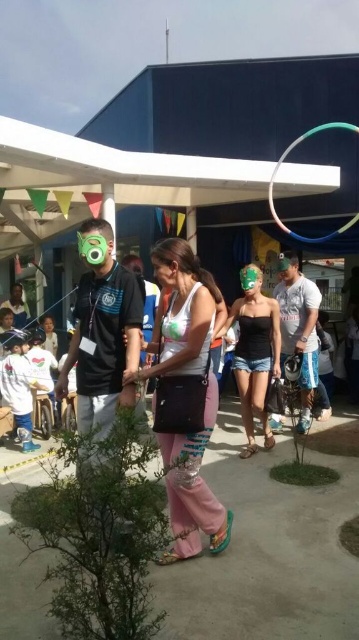
Question: Which object appears closest to the camera in this image?

Choices:
 (A) pink fabric pants at center
 (B) green rubber hula hoop at upper center

Answer: (A)

Question: Does green rubber hula hoop at upper center have a greater width compared to green matte goggles at center?

Choices:
 (A) yes
 (B) no

Answer: (A)

Question: Is pink fabric pants at center smaller than green rubber hula hoop at upper center?

Choices:
 (A) no
 (B) yes

Answer: (B)

Question: Among these objects, which one is nearest to the camera?

Choices:
 (A) matte green mask at center
 (B) green rubber hula hoop at upper center
 (C) pink fabric pants at center
 (D) green matte goggles at center

Answer: (C)

Question: Estimate the real-world distances between objects in this image. Which object is farther from the green matte goggles at center?

Choices:
 (A) green rubber hula hoop at upper center
 (B) pink fabric pants at center

Answer: (A)

Question: Is green rubber hula hoop at upper center wider than green matte goggles at center?

Choices:
 (A) no
 (B) yes

Answer: (B)